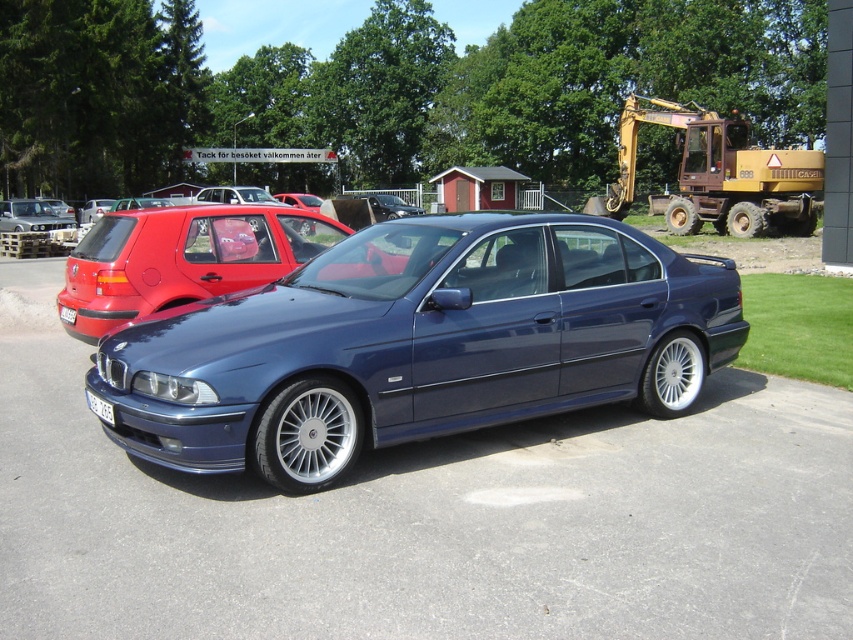
Does point (224, 205) come closer to viewer compared to point (90, 400)?

No, it is not.

Does matte black car at center have a lesser height compared to white plastic license plate at lower center?

No, matte black car at center is not shorter than white plastic license plate at lower center.

Which is in front, point (268, 218) or point (103, 413)?

Point (103, 413)

What are the coordinates of `matte black car at center` in the screenshot? It's located at (183, 259).

Based on the photo, is matte black car at left smaller than white plastic license plate at lower center?

No, matte black car at left is not smaller than white plastic license plate at lower center.

This screenshot has height=640, width=853. What are the coordinates of `matte black car at left` in the screenshot? It's located at (30, 216).

Based on the photo, is yellow metallic excavator at upper right bigger than white plastic license plate at lower center?

Yes, yellow metallic excavator at upper right is bigger than white plastic license plate at lower center.

Can you confirm if yellow metallic excavator at upper right is positioned to the right of white plastic license plate at lower center?

Correct, you'll find yellow metallic excavator at upper right to the right of white plastic license plate at lower center.

Describe the element at coordinates (718, 176) in the screenshot. I see `yellow metallic excavator at upper right` at that location.

This screenshot has height=640, width=853. What are the coordinates of `yellow metallic excavator at upper right` in the screenshot? It's located at coord(718,176).